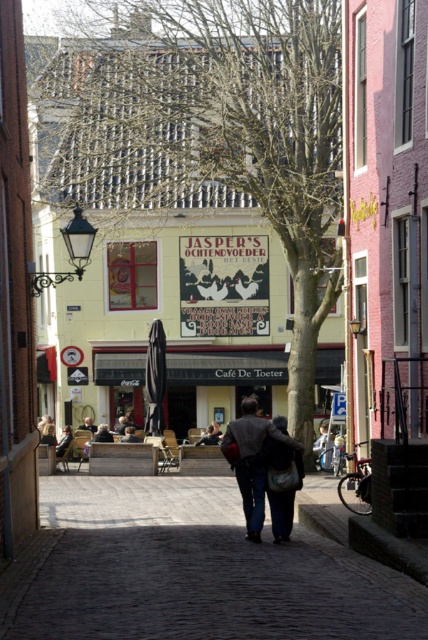
Question: Does green leafy tree at center have a larger size compared to dark gray fabric coat at center?

Choices:
 (A) no
 (B) yes

Answer: (B)

Question: Among these objects, which one is farthest from the camera?

Choices:
 (A) dark gray fabric coat at center
 (B) dark gray suit at center
 (C) dark cobblestone pavement at center
 (D) green leafy tree at center

Answer: (B)

Question: Which point is farther to the camera?

Choices:
 (A) click(x=247, y=529)
 (B) click(x=118, y=76)

Answer: (B)

Question: Does green leafy tree at center appear under dark gray suit at center?

Choices:
 (A) yes
 (B) no

Answer: (B)

Question: Which point appears closest to the camera in this image?

Choices:
 (A) (92, 429)
 (B) (231, 422)

Answer: (B)

Question: Is green leafy tree at center to the left of dark gray suit at center from the viewer's perspective?

Choices:
 (A) no
 (B) yes

Answer: (A)